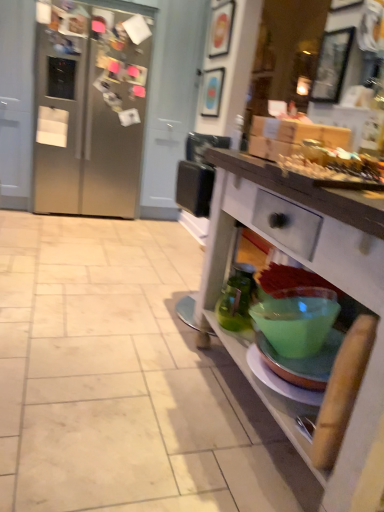
Find the location of a particular element. This screenshot has height=512, width=384. vacant region in front of satin silver refrigerator at left is located at coordinates (74, 246).